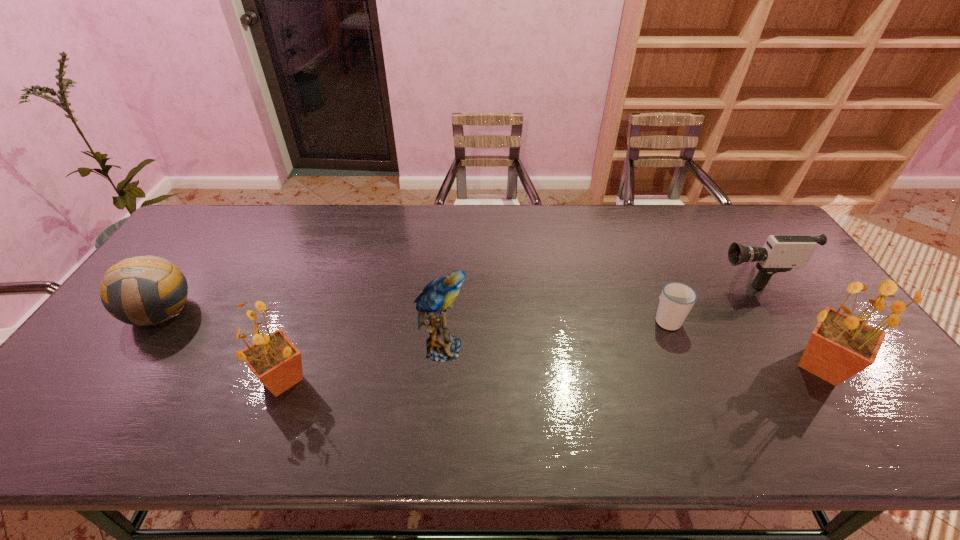
Identify the location of vacant position for inserting another sunflower evenly. This screenshot has width=960, height=540. (556, 373).